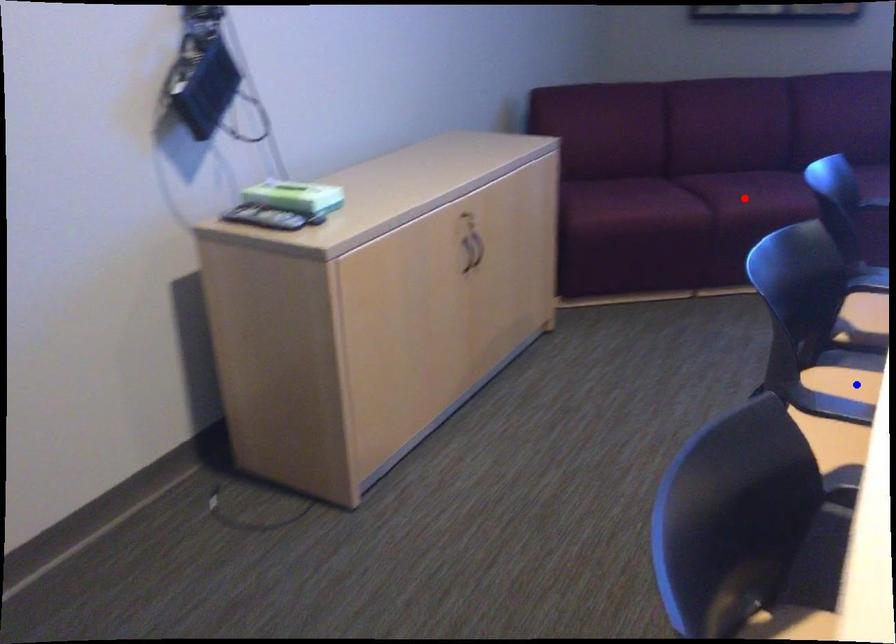
Question: Which of the two points in the image is closer to the camera?

Choices:
 (A) Blue point is closer.
 (B) Red point is closer.

Answer: (A)